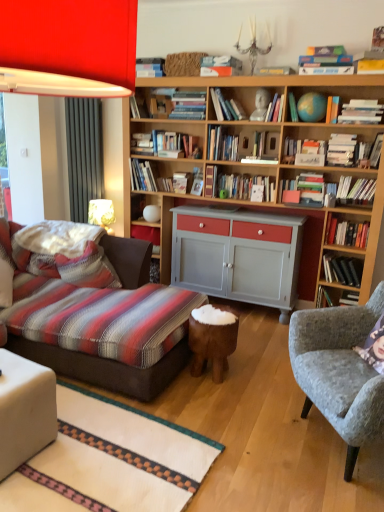
Question: In terms of height, does hardcover book at upper right, the eighth book in the right-to-left sequence, look taller or shorter compared to white fabric ottoman at lower left?

Choices:
 (A) short
 (B) tall

Answer: (A)

Question: In terms of width, does hardcover book at upper right, the eighth book in the right-to-left sequence, look wider or thinner when compared to white fabric ottoman at lower left?

Choices:
 (A) thin
 (B) wide

Answer: (A)

Question: Which is nearer to the gray fabric armchair at right?

Choices:
 (A) striped fabric pillow at lower left
 (B) hardcover book at upper center, the eighth book viewed from the left
 (C) hardcover book at center-right, placed as the 11th book when sorted from left to right
 (D) hardcover book at upper center, which appears as the first book when viewed from the left
 (E) hardcover book at upper center, the 14th book in the right-to-left sequence

Answer: (A)

Question: Which of these objects is positioned farthest from the brown wooden stool at center?

Choices:
 (A) gray fabric armchair at right
 (B) white fabric ottoman at lower left
 (C) matte red shelf at center
 (D) hardcover book at upper center, marked as the twentieth book in a right-to-left arrangement
 (E) hardcover book at upper right, which is the 19th book in left-to-right order

Answer: (D)